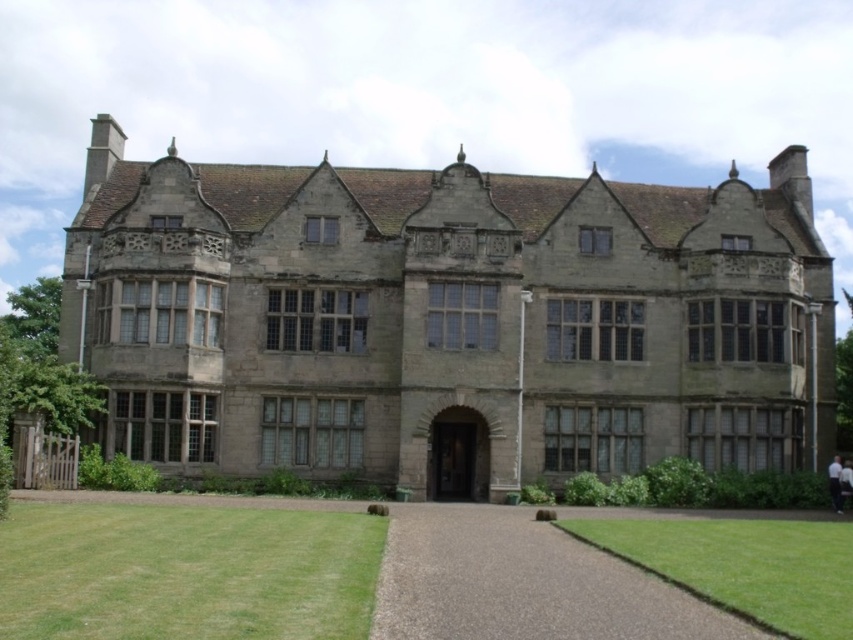
Is green grass at lower left above green grass at lower right?

Correct, green grass at lower left is located above green grass at lower right.

Is green grass at lower left shorter than green grass at lower right?

Yes.

Does point (366, 580) come farther from viewer compared to point (740, 570)?

No, (366, 580) is closer to viewer.

The width and height of the screenshot is (853, 640). I want to click on green grass at lower left, so click(186, 572).

Is gray stone mansion at center smaller than green grass at lower left?

No.

Based on the photo, is gray stone mansion at center above green grass at lower left?

Yes.

The width and height of the screenshot is (853, 640). Describe the element at coordinates (448, 320) in the screenshot. I see `gray stone mansion at center` at that location.

Locate an element on the screen. gray stone mansion at center is located at coordinates (448, 320).

Does brown gravel driveway at center have a greater width compared to green grass at lower right?

In fact, brown gravel driveway at center might be narrower than green grass at lower right.

Is brown gravel driveway at center to the right of green grass at lower right from the viewer's perspective?

In fact, brown gravel driveway at center is to the left of green grass at lower right.

Is point (519, 557) closer to camera compared to point (688, 531)?

Yes, it is.

This screenshot has height=640, width=853. Identify the location of brown gravel driveway at center. (523, 582).